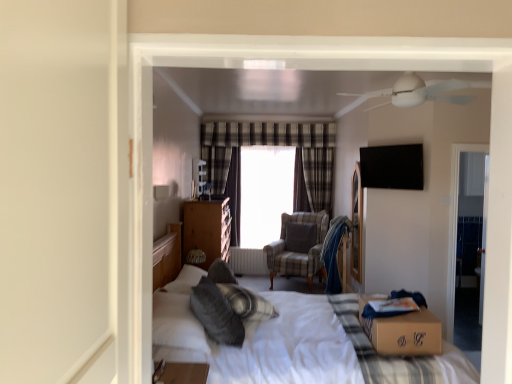
Question: Is brown cardboard box at center spatially inside gray fabric pillow at center, placed as the 2th pillow when sorted from front to back, or outside of it?

Choices:
 (A) outside
 (B) inside

Answer: (A)

Question: From the image's perspective, is brown cardboard box at center located above or below gray fabric pillow at center, the 1th pillow from the back?

Choices:
 (A) above
 (B) below

Answer: (B)

Question: Which object is positioned closest to the soft gray pillow at center, the 1th pillow from the front?

Choices:
 (A) transparent glass window screen at center
 (B) brown cardboard box at lower right
 (C) plaid fabric curtain at center
 (D) white metallic radiator at center
 (E) white soft bed at center

Answer: (E)

Question: Considering the real-world distances, which object is farthest from the white soft bed at center?

Choices:
 (A) soft gray pillow at center, the 1th pillow from the front
 (B) plaid fabric curtain at center
 (C) brown cardboard box at lower right
 (D) transparent glass window screen at center
 (E) wooden nightstand at center

Answer: (B)